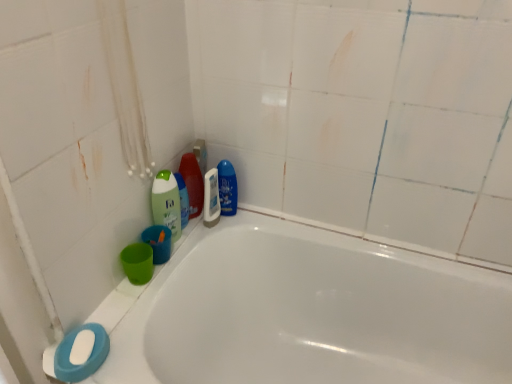
Locate an element on the screen. The height and width of the screenshot is (384, 512). free point behind white matte soap at lower left is located at coordinates (124, 308).